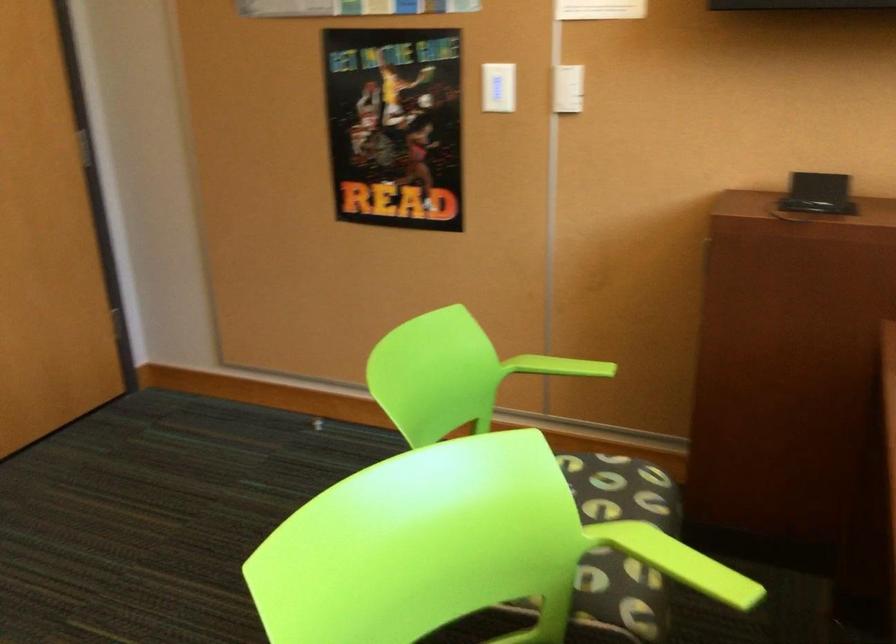
The width and height of the screenshot is (896, 644). Describe the element at coordinates (567, 89) in the screenshot. I see `a white light switch` at that location.